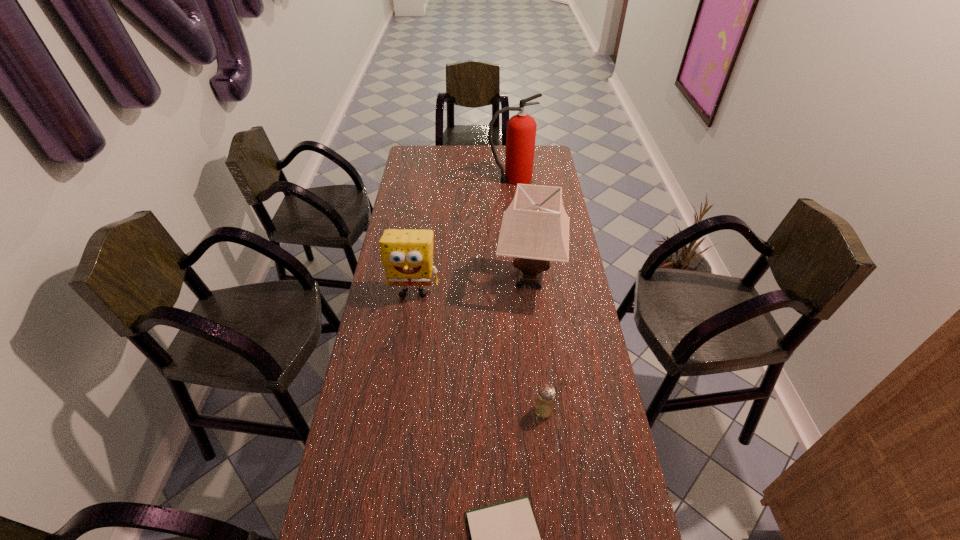
Locate an element on the screen. This screenshot has width=960, height=540. object located in the left edge section of the desktop is located at coordinates (407, 255).

At what (x,y) coordinates should I click in order to perform the action: click on fire extinguisher present at the right edge. Please return your answer as a coordinate pair (x, y). Image resolution: width=960 pixels, height=540 pixels. Looking at the image, I should click on (521, 128).

Locate an element on the screen. The image size is (960, 540). lampshade that is positioned at the right edge is located at coordinates (535, 228).

Image resolution: width=960 pixels, height=540 pixels. I want to click on vacant space at the far edge of the desktop, so click(460, 147).

Locate an element on the screen. Image resolution: width=960 pixels, height=540 pixels. blank space at the left edge of the desktop is located at coordinates (353, 481).

Where is `vacant area at the right edge of the desktop`? vacant area at the right edge of the desktop is located at coordinates (562, 271).

In the image, there is a desktop. Identify the location of vacant space at the far left corner. The image size is (960, 540). (411, 160).

I want to click on empty location between the saltshaker and the farthest object, so click(527, 294).

Locate an element on the screen. free area in between the farthest object and the saltshaker is located at coordinates (527, 294).

Where is `blank region between the lampshade and the third tallest object`? blank region between the lampshade and the third tallest object is located at coordinates (471, 286).